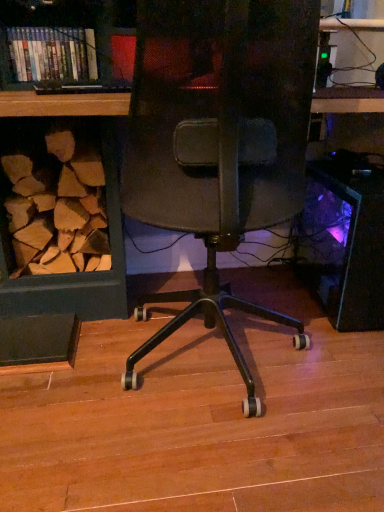
What do you see at coordinates (345, 239) in the screenshot? The width and height of the screenshot is (384, 512). I see `black plastic desktop at right` at bounding box center [345, 239].

In order to face black plastic desktop at right, should I rotate leftwards or rightwards?

Rotate right and turn 20.349 degrees.

This screenshot has height=512, width=384. I want to click on black plastic desktop at right, so pyautogui.click(x=345, y=239).

Image resolution: width=384 pixels, height=512 pixels. Identify the location of hardcover books at upper left. (52, 53).

The image size is (384, 512). What do you see at coordinates (52, 53) in the screenshot?
I see `hardcover books at upper left` at bounding box center [52, 53].

In order to click on black plastic desktop at right in this screenshot , I will do `click(345, 239)`.

Visually, is hardcover books at upper left positioned to the left or to the right of black plastic desktop at right?

Clearly, hardcover books at upper left is on the left of black plastic desktop at right in the image.

Is hardcover books at upper left in front of or behind black plastic desktop at right in the image?

Clearly, hardcover books at upper left is behind black plastic desktop at right.

Is point (73, 67) behind point (366, 174)?

Yes, it is behind point (366, 174).

From the image's perspective, which object appears higher, hardcover books at upper left or black plastic desktop at right?

hardcover books at upper left is shown above in the image.

From a real-world perspective, is hardcover books at upper left located higher than black plastic desktop at right?

Yes, from a real-world perspective, hardcover books at upper left is over black plastic desktop at right

Can you confirm if hardcover books at upper left is wider than black plastic desktop at right?

No, hardcover books at upper left is not wider than black plastic desktop at right.

From their relative heights in the image, would you say hardcover books at upper left is taller or shorter than black plastic desktop at right?

Considering their sizes, hardcover books at upper left has less height than black plastic desktop at right.

Can you confirm if hardcover books at upper left is smaller than black plastic desktop at right?

Correct, hardcover books at upper left occupies less space than black plastic desktop at right.

Can we say hardcover books at upper left lies outside black plastic desktop at right?

Yes, hardcover books at upper left is located beyond the bounds of black plastic desktop at right.

Consider the image. Is there a large distance between hardcover books at upper left and black plastic desktop at right?

hardcover books at upper left is positioned a significant distance from black plastic desktop at right.

Is hardcover books at upper left facing away from black plastic desktop at right?

No, black plastic desktop at right is not at the back of hardcover books at upper left.

Can you tell me how much hardcover books at upper left and black plastic desktop at right differ in facing direction?

hardcover books at upper left and black plastic desktop at right are facing 0.779 degrees away from each other.

In order to click on desktop computer that is under the hardcover books at upper left (from a real-world perspective) in this screenshot , I will do `click(345, 239)`.

Can you confirm if black plastic desktop at right is positioned to the left of hardcover books at upper left?

Incorrect, black plastic desktop at right is not on the left side of hardcover books at upper left.

Does black plastic desktop at right come in front of hardcover books at upper left?

Yes, black plastic desktop at right is closer to the camera.

Is point (378, 259) closer or farther from the camera than point (46, 62)?

Point (378, 259).

From the image's perspective, is black plastic desktop at right above or below hardcover books at upper left?

Clearly, from the image's perspective, black plastic desktop at right is below hardcover books at upper left.

From the picture: From a real-world perspective, between black plastic desktop at right and hardcover books at upper left, who is vertically higher?

hardcover books at upper left is physically above.

Considering the sizes of objects black plastic desktop at right and hardcover books at upper left in the image provided, who is thinner, black plastic desktop at right or hardcover books at upper left?

hardcover books at upper left is thinner.

Who is shorter, black plastic desktop at right or hardcover books at upper left?

With less height is hardcover books at upper left.

Consider the image. Does black plastic desktop at right have a larger size compared to hardcover books at upper left?

Correct, black plastic desktop at right is larger in size than hardcover books at upper left.

Would you say black plastic desktop at right is inside or outside hardcover books at upper left?

black plastic desktop at right is not inside hardcover books at upper left, it's outside.

Is black plastic desktop at right far from hardcover books at upper left?

Yes, black plastic desktop at right is far from hardcover books at upper left.

Is black plastic desktop at right oriented towards hardcover books at upper left?

No, black plastic desktop at right is not turned towards hardcover books at upper left.

What's the angular difference between black plastic desktop at right and hardcover books at upper left's facing directions?

There is a 0.779-degree angle between the facing directions of black plastic desktop at right and hardcover books at upper left.

Measure the distance between black plastic desktop at right and hardcover books at upper left.

A distance of 3.52 feet exists between black plastic desktop at right and hardcover books at upper left.

Where is `desktop computer that appears in front of the hardcover books at upper left`? This screenshot has height=512, width=384. desktop computer that appears in front of the hardcover books at upper left is located at coordinates (345, 239).

In order to click on book to the left of black plastic desktop at right in this screenshot , I will do `click(52, 53)`.

You are a GUI agent. You are given a task and a screenshot of the screen. Output one action in this format:
    pyautogui.click(x=<x>, y=<y>)
    Task: Click on the book above the black plastic desktop at right (from the image's perspective)
    The width and height of the screenshot is (384, 512).
    Given the screenshot: What is the action you would take?
    pyautogui.click(x=52, y=53)